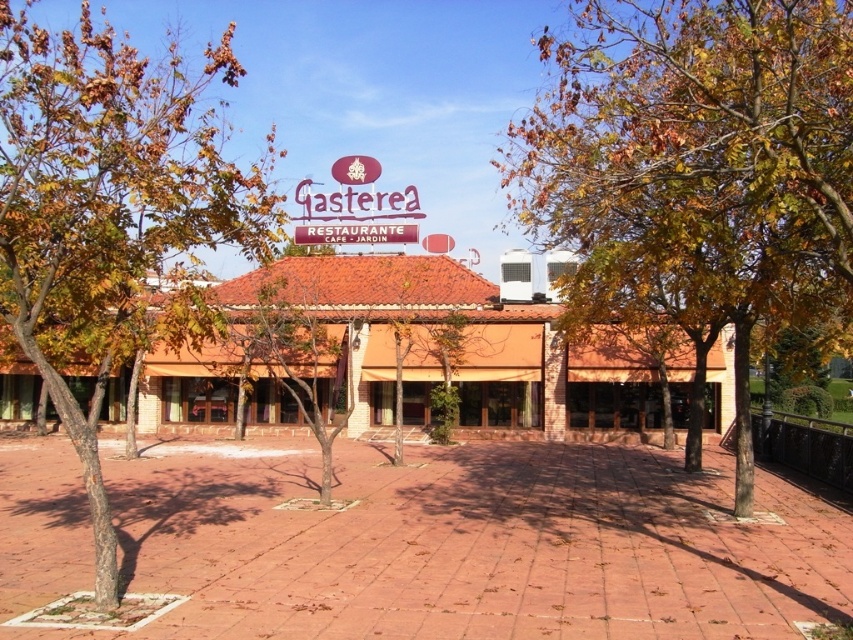
You are standing in front of the restaurant and want to take a photo of the maroon signboard. Where should you position yourself to ensure the brown leafy tree at left is not blocking the view?

Position yourself to the right side of the scene, away from the brown leafy tree at left, which is located at the lower left corner at coordinates approximately (105, 205). This will keep the tree out of the frame while capturing the maroon signboard clearly.